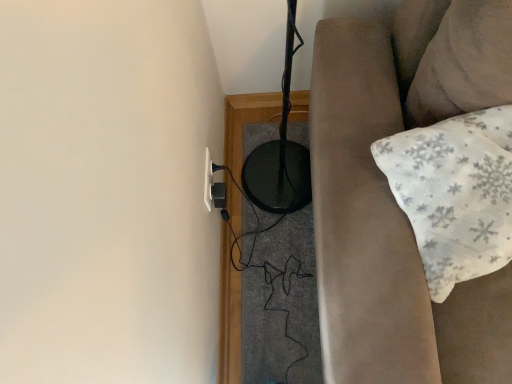
This screenshot has width=512, height=384. Describe the element at coordinates (455, 193) in the screenshot. I see `white textured pillow at right` at that location.

In order to click on white textured pillow at right in this screenshot , I will do `click(455, 193)`.

I want to click on white textured pillow at right, so click(455, 193).